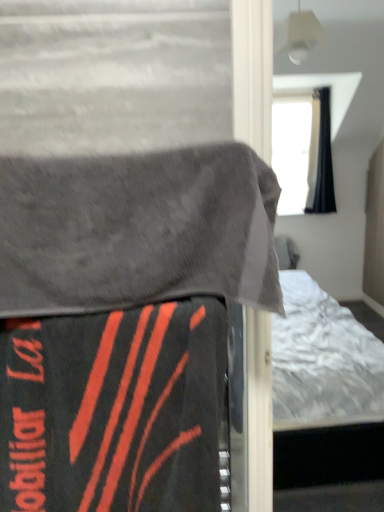
Question: In the image, is gray fabric blanket at upper left, the first blanket in the top-to-bottom sequence, positioned in front of or behind black matte blanket at lower left, positioned as the second blanket in top-to-bottom order?

Choices:
 (A) front
 (B) behind

Answer: (A)

Question: Is gray fabric blanket at upper left, placed as the 2th blanket when sorted from bottom to top, taller or shorter than black matte blanket at lower left, positioned as the second blanket in top-to-bottom order?

Choices:
 (A) tall
 (B) short

Answer: (B)

Question: Estimate the real-world distances between objects in this image. Which object is closer to the black matte blanket at lower left, positioned as the second blanket in top-to-bottom order?

Choices:
 (A) velvet-like black bed at center
 (B) gray fabric blanket at upper left, placed as the 2th blanket when sorted from bottom to top

Answer: (A)

Question: Which object is the closest to the velvet-like black bed at center?

Choices:
 (A) black matte blanket at lower left, the 1th blanket from the bottom
 (B) gray fabric blanket at upper left, the first blanket in the top-to-bottom sequence

Answer: (A)